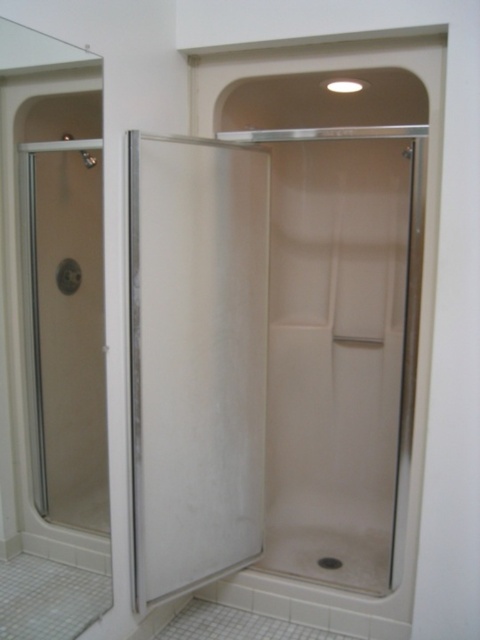
Question: Which point is closer to the camera?

Choices:
 (A) (149, 547)
 (B) (97, 387)

Answer: (B)

Question: Which point is farther to the camera?

Choices:
 (A) (187, 397)
 (B) (59, 278)

Answer: (A)

Question: Where is transparent glass shower door at center located in relation to clear glass shower door at left in the image?

Choices:
 (A) below
 (B) above

Answer: (A)

Question: Which point is farther to the camera?

Choices:
 (A) (176, 170)
 (B) (51, 260)

Answer: (A)

Question: From the image, what is the correct spatial relationship of transparent glass shower door at center in relation to clear glass shower door at left?

Choices:
 (A) above
 (B) below

Answer: (B)

Question: Is transparent glass shower door at center positioned in front of clear glass shower door at left?

Choices:
 (A) yes
 (B) no

Answer: (B)